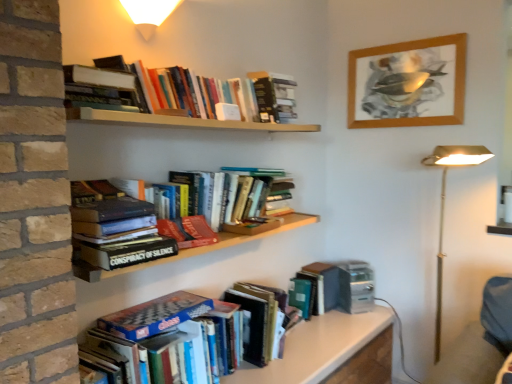
Find the location of a particular element. The height and width of the screenshot is (384, 512). empty space that is ontop of white glossy table at lower center (from a real-world perspective) is located at coordinates (314, 340).